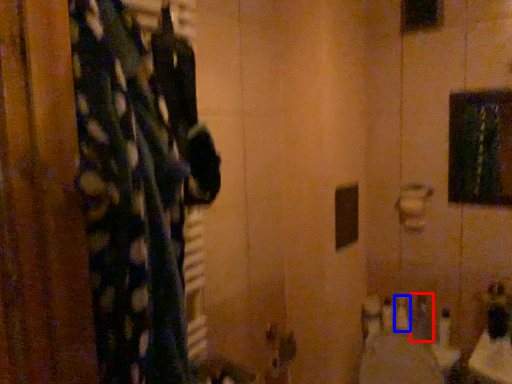
Question: Which object appears closest to the camera in this image, toiletry (highlighted by a red box) or toiletry (highlighted by a blue box)?

Choices:
 (A) toiletry
 (B) toiletry

Answer: (A)